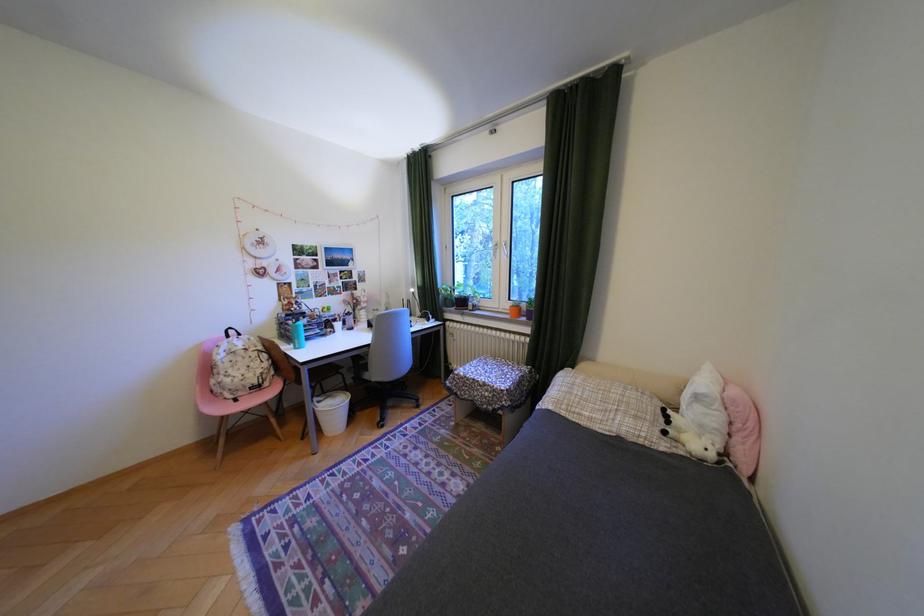
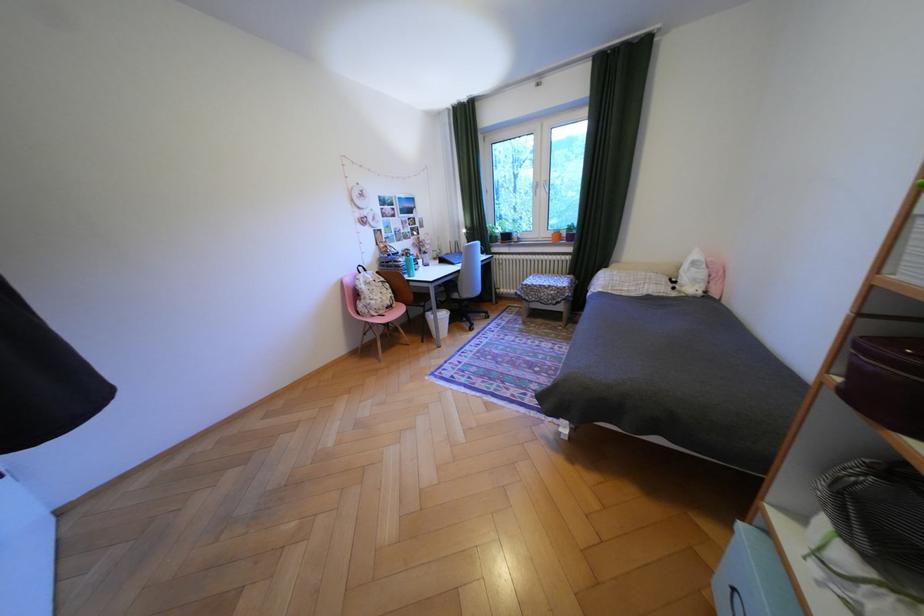
Locate, in the second image, the point that corresponds to the point at 251,394 in the first image.

(393, 312)